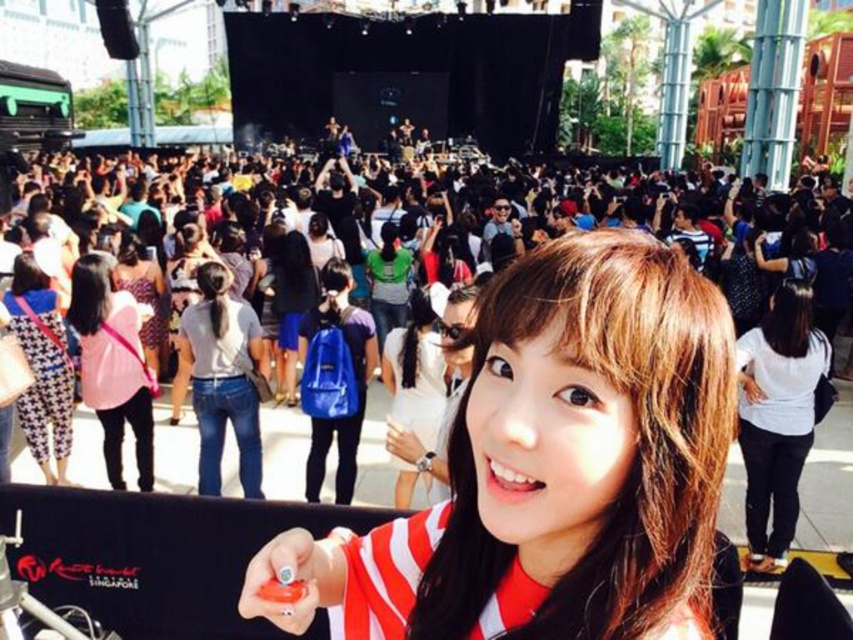
Is matte red striped shirt at center below white matte shirt at center?

Correct, matte red striped shirt at center is located below white matte shirt at center.

Is matte red striped shirt at center shorter than white matte shirt at center?

Incorrect, matte red striped shirt at center's height does not fall short of white matte shirt at center's.

Where is `matte red striped shirt at center`? The image size is (853, 640). matte red striped shirt at center is located at coordinates (553, 467).

Is point (689, 552) in front of point (99, 362)?

Yes, point (689, 552) is closer to viewer.

Which of these two, matte red striped shirt at center or pink fabric bag at center, stands shorter?

Standing shorter between the two is pink fabric bag at center.

Who is more forward, (569,352) or (70,275)?

Point (569,352) is in front.

Where is `matte red striped shirt at center`? matte red striped shirt at center is located at coordinates (553, 467).

Is pink fabric bag at center positioned behind houndstooth fabric pants at center?

Yes, it is behind houndstooth fabric pants at center.

How far apart are pink fabric bag at center and houndstooth fabric pants at center?

pink fabric bag at center and houndstooth fabric pants at center are 11.18 feet apart from each other.

Find the location of a particular element. This screenshot has width=853, height=640. pink fabric bag at center is located at coordinates (112, 365).